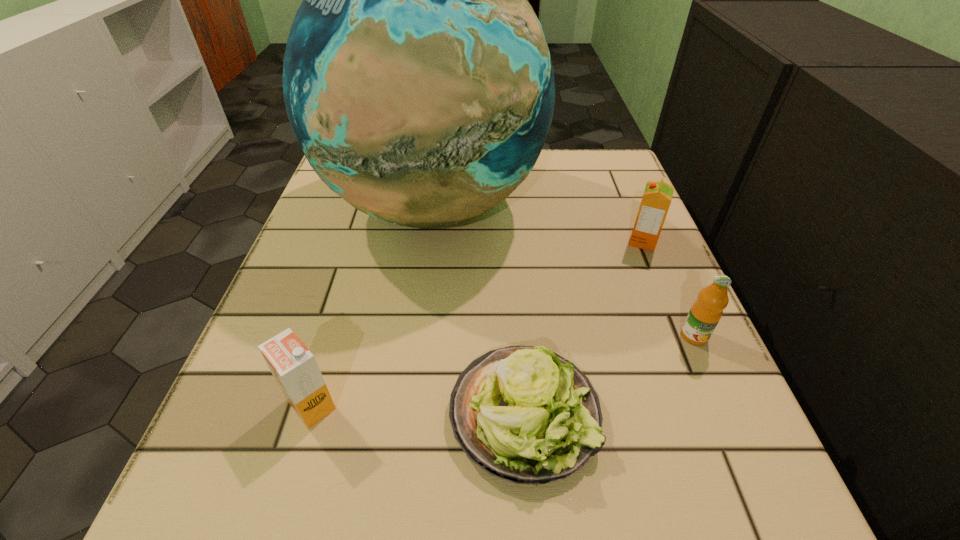
This screenshot has height=540, width=960. In order to click on vacant area that lies between the farthest orange juice and the lettuce in this screenshot , I will do `click(584, 328)`.

Where is `free point between the globe and the third farthest object`? Image resolution: width=960 pixels, height=540 pixels. free point between the globe and the third farthest object is located at coordinates (564, 271).

Identify the location of free space between the tallest object and the farthest orange juice. (538, 224).

The width and height of the screenshot is (960, 540). What are the coordinates of `vacant area that lies between the nearest orange juice and the tallest object` in the screenshot? It's located at (372, 305).

I want to click on vacant space that's between the shortest object and the tallest object, so click(x=478, y=310).

Locate an element on the screen. This screenshot has height=540, width=960. vacant area between the globe and the farthest orange juice is located at coordinates (538, 224).

The height and width of the screenshot is (540, 960). In order to click on free space between the shortest object and the third farthest object in this screenshot , I will do `click(609, 375)`.

Find the location of a particular element. vacant area that lies between the third nearest object and the farthest orange juice is located at coordinates (668, 288).

This screenshot has width=960, height=540. Find the location of `vacant area that lies between the globe and the leftmost orange juice`. vacant area that lies between the globe and the leftmost orange juice is located at coordinates (372, 305).

At what (x,y) coordinates should I click in order to perform the action: click on free spot between the nearest orange juice and the tallest object. Please return your answer as a coordinate pair (x, y). This screenshot has width=960, height=540. Looking at the image, I should click on (372, 305).